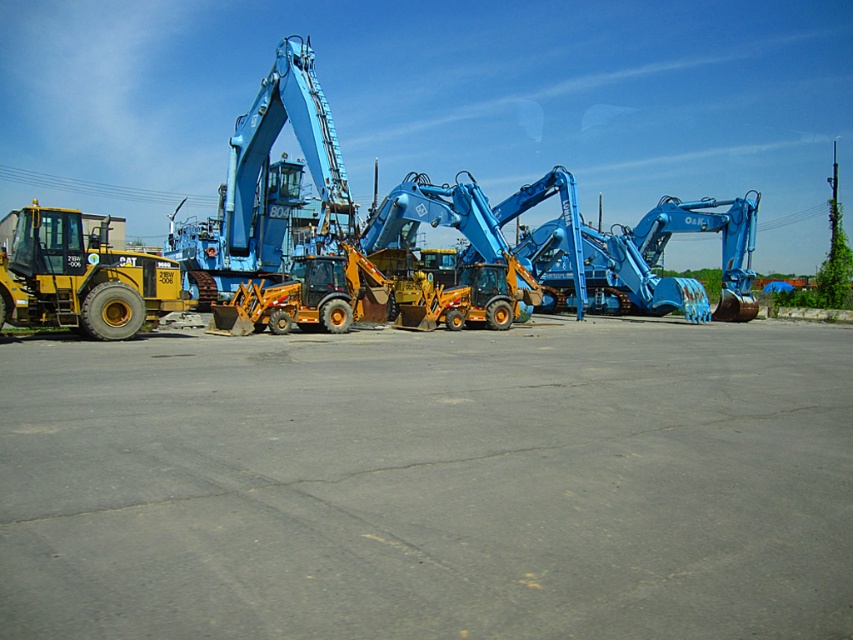
Question: Estimate the real-world distances between objects in this image. Which object is closer to the matte yellow tractor at left?

Choices:
 (A) matte blue excavator at center
 (B) gray asphalt parking lot at center

Answer: (B)

Question: Which point is closer to the camera?

Choices:
 (A) matte yellow tractor at left
 (B) matte blue excavator at center

Answer: (A)

Question: Among these points, which one is nearest to the camera?

Choices:
 (A) (805, 422)
 (B) (22, 321)

Answer: (A)

Question: Can you confirm if gray asphalt parking lot at center is wider than matte yellow tractor at left?

Choices:
 (A) yes
 (B) no

Answer: (A)

Question: Does gray asphalt parking lot at center appear under matte blue excavator at center?

Choices:
 (A) yes
 (B) no

Answer: (A)

Question: Is the position of gray asphalt parking lot at center less distant than that of matte blue excavator at center?

Choices:
 (A) yes
 (B) no

Answer: (A)